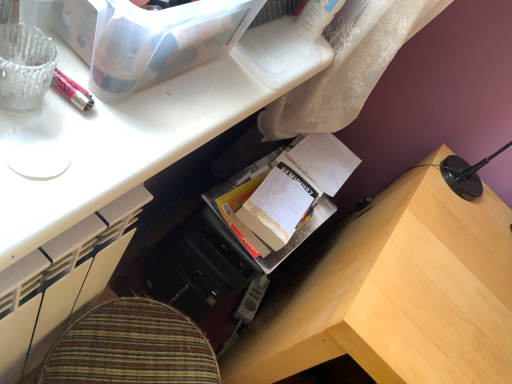
Image resolution: width=512 pixels, height=384 pixels. What are the coordinates of `vacant point to the right of translucent glass pen at upper left` in the screenshot? It's located at coord(80,158).